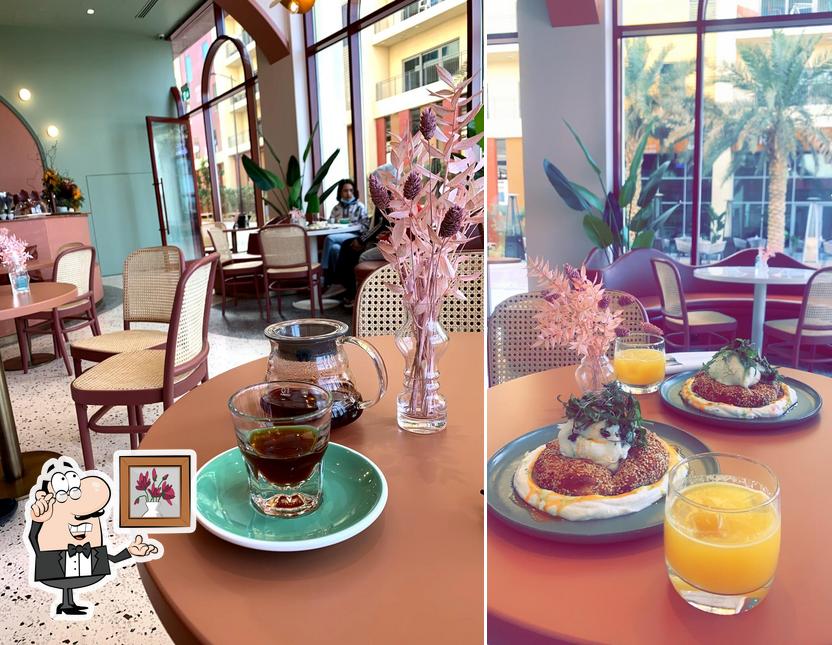
You are a GUI agent. You are given a task and a screenshot of the screen. Output one action in this format:
    pyautogui.click(x=<x>, y=<y>)
    Task: Click on the tile floor
    The width and height of the screenshot is (832, 645).
    Given the screenshot: What is the action you would take?
    pyautogui.click(x=46, y=415), pyautogui.click(x=226, y=344), pyautogui.click(x=22, y=620)